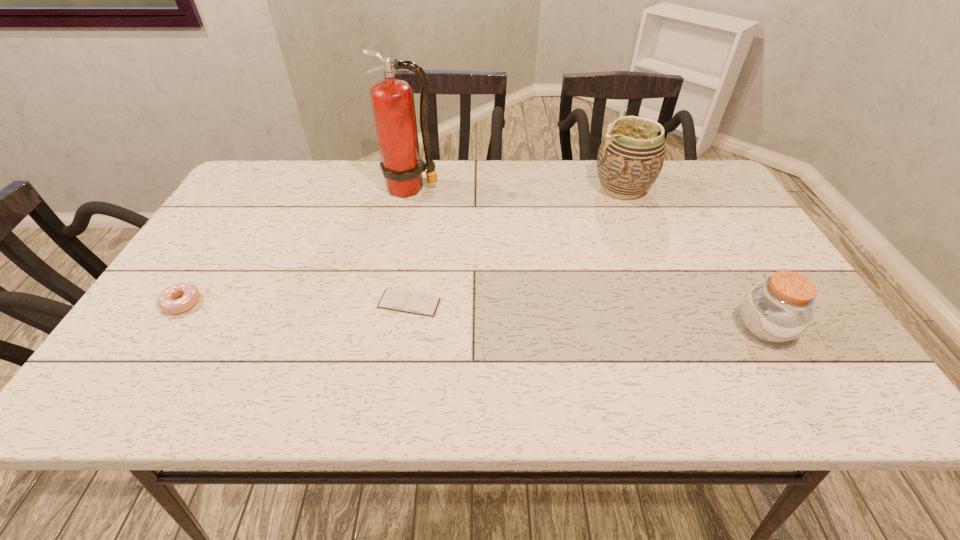
In order to click on vacant point located between the second object from right to left and the fourth tallest object in this screenshot , I will do `click(402, 246)`.

Identify the location of free space between the shortest object and the second shortest object. (296, 303).

You are a GUI agent. You are given a task and a screenshot of the screen. Output one action in this format:
    pyautogui.click(x=<x>, y=<y>)
    Task: Click on the free space between the diary and the doughnut
    The height and width of the screenshot is (540, 960).
    Given the screenshot: What is the action you would take?
    pyautogui.click(x=296, y=303)

Find the location of a particular element. Image resolution: width=960 pixels, height=540 pixels. free space between the tallest object and the fourth object from left to right is located at coordinates (516, 188).

Where is `object that can be found as the fourth closest to the doughnut`? object that can be found as the fourth closest to the doughnut is located at coordinates (780, 309).

Locate which object is the second closest to the tallest object. Please provide its 2D coordinates. Your answer should be formatted as a tuple, i.e. [(x, y)], where the tuple contains the x and y coordinates of a point satisfying the conditions above.

[(630, 158)]

The width and height of the screenshot is (960, 540). I want to click on free location that satisfies the following two spatial constraints: 1. at the nozzle of the fire extinguisher; 2. on the left side of the jar, so pos(384,328).